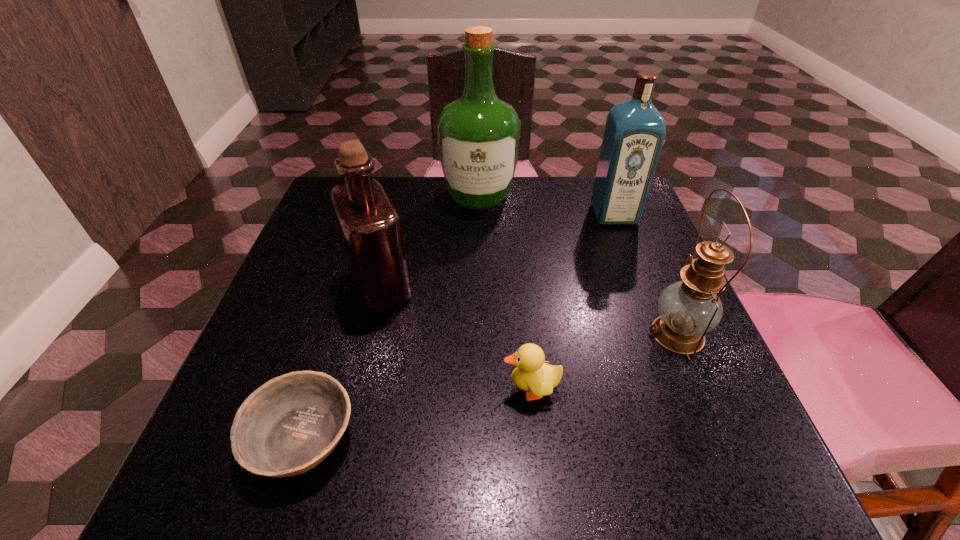
Select which liquor appears as the second closest to the rightmost liquor. Please provide its 2D coordinates. Your answer should be formatted as a tuple, i.e. [(x, y)], where the tuple contains the x and y coordinates of a point satisfying the conditions above.

[(370, 229)]

This screenshot has width=960, height=540. In order to click on free space that satisfies the following two spatial constraints: 1. on the front side of the nearest liquor; 2. on the left side of the oil lamp in this screenshot , I will do `click(370, 334)`.

You are a GUI agent. You are given a task and a screenshot of the screen. Output one action in this format:
    pyautogui.click(x=<x>, y=<y>)
    Task: Click on the vacant region that satisfies the following two spatial constraints: 1. on the flat label side of the oil lamp; 2. on the right side of the rightmost liquor
    This screenshot has width=960, height=540.
    Given the screenshot: What is the action you would take?
    click(660, 334)

Locate an element on the screen. free spot that satisfies the following two spatial constraints: 1. on the back side of the shortest object; 2. on the left side of the nearest liquor is located at coordinates (348, 288).